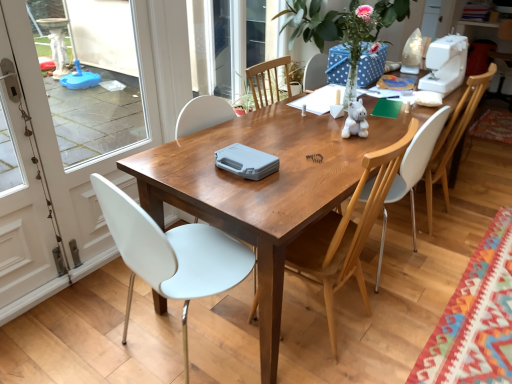
Find the location of a particular element. Image resolution: width=512 pixels, height=384 pixels. free spot below white plastic chair at left, acting as the 1th chair starting from the left (from a real-world perspective) is located at coordinates [x=172, y=355].